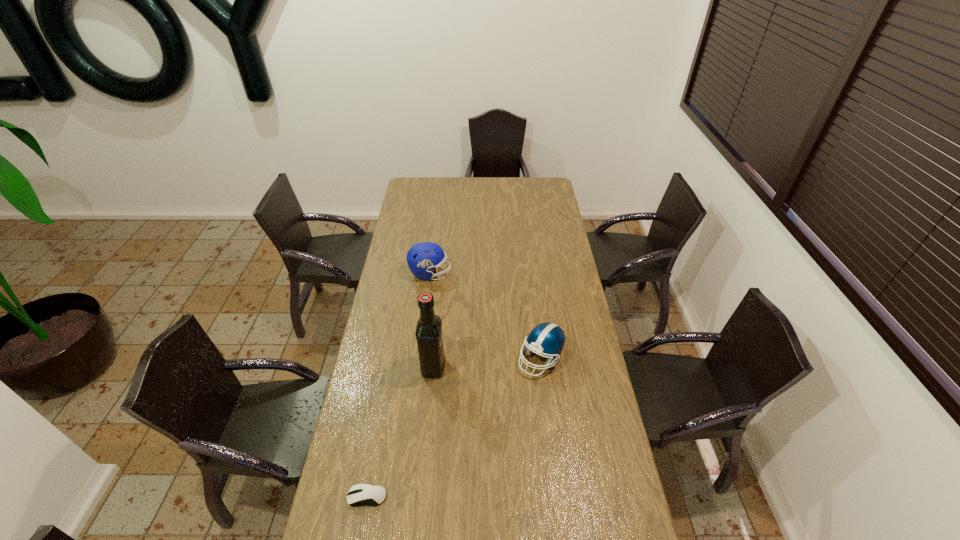
Where is `free space located on the front of the mouse`? The width and height of the screenshot is (960, 540). free space located on the front of the mouse is located at coordinates (361, 529).

You are a GUI agent. You are given a task and a screenshot of the screen. Output one action in this format:
    pyautogui.click(x=<x>, y=<y>)
    Task: Click on the football helmet situated at the left edge
    
    Given the screenshot: What is the action you would take?
    pyautogui.click(x=423, y=257)

Identify the location of mouse situated at the left edge. (359, 494).

The height and width of the screenshot is (540, 960). Find the location of `object that is at the right edge`. object that is at the right edge is located at coordinates (548, 339).

The width and height of the screenshot is (960, 540). In order to click on vacant space at the far edge of the desktop in this screenshot , I will do `click(495, 182)`.

The height and width of the screenshot is (540, 960). In order to click on blank space at the left edge of the desktop in this screenshot , I will do `click(420, 214)`.

Image resolution: width=960 pixels, height=540 pixels. I want to click on blank space at the right edge of the desktop, so click(x=566, y=305).

Where is `free spot between the tallest object and the rightmost object`? free spot between the tallest object and the rightmost object is located at coordinates (487, 363).

Where is `free spot between the mouse and the farther football helmet`? This screenshot has height=540, width=960. free spot between the mouse and the farther football helmet is located at coordinates (398, 385).

The width and height of the screenshot is (960, 540). In order to click on free space between the right football helmet and the left football helmet in this screenshot , I will do `click(486, 316)`.